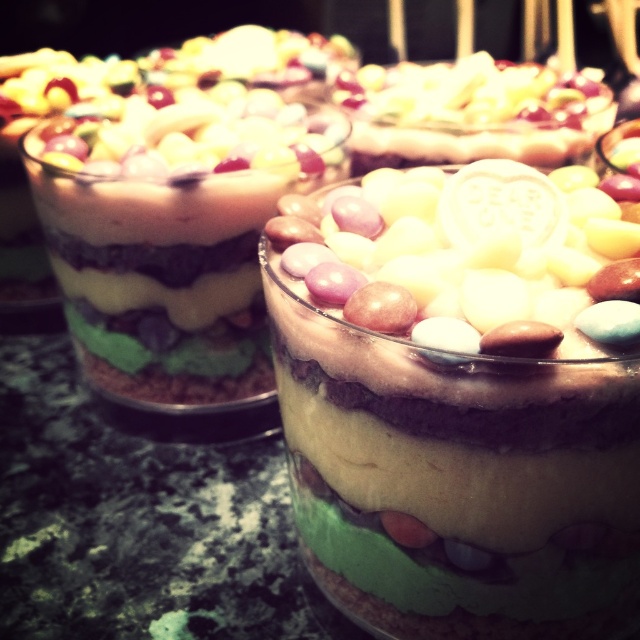
Does smooth chocolate pudding at center appear under white matte heart-shaped candy at center?

Correct, smooth chocolate pudding at center is located below white matte heart-shaped candy at center.

Is smooth chocolate pudding at center smaller than white matte heart-shaped candy at center?

Actually, smooth chocolate pudding at center might be larger than white matte heart-shaped candy at center.

Between point (625, 561) and point (358, 256), which one is positioned behind?

The point (358, 256) is more distant.

The width and height of the screenshot is (640, 640). I want to click on smooth chocolate pudding at center, so click(x=458, y=477).